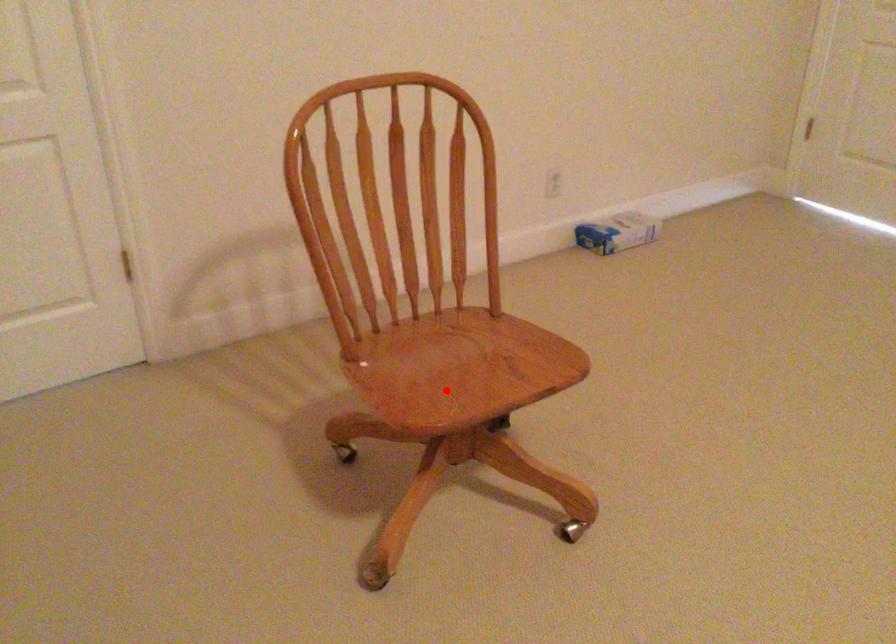
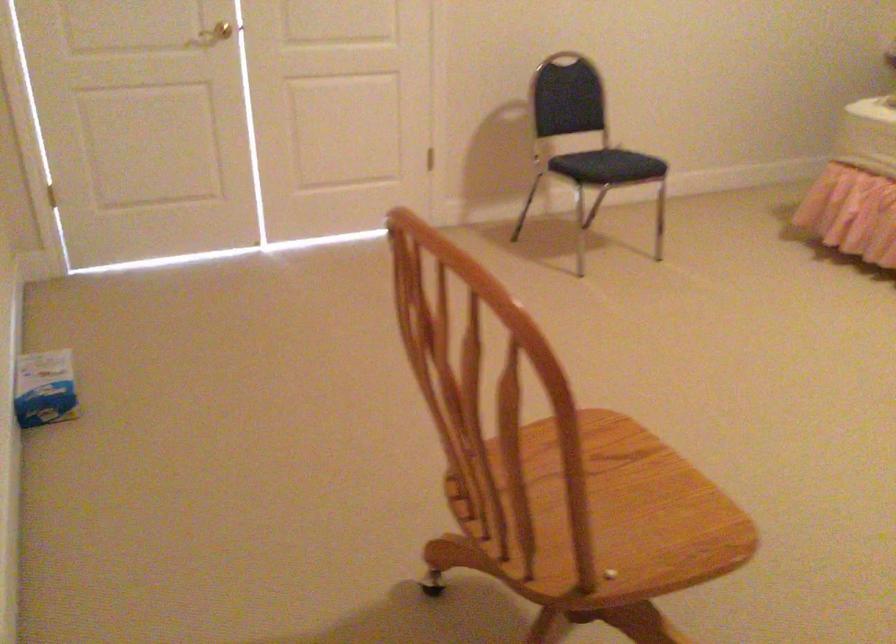
Question: A red point is marked in image1. In image2, is the corresponding 3D point closer to the camera or farther? Reply with the corresponding letter.

Choices:
 (A) The corresponding 3D point is closer.
 (B) The corresponding 3D point is farther.

Answer: (A)